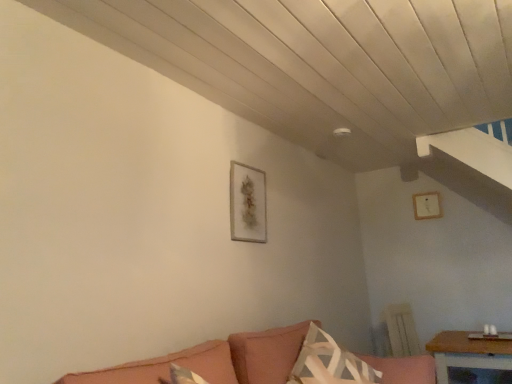
Question: Is white textured pillow at lower center located within velvet pink couch at lower center?

Choices:
 (A) yes
 (B) no

Answer: (A)

Question: Can you confirm if velvet pink couch at lower center is bigger than white textured pillow at lower center?

Choices:
 (A) no
 (B) yes

Answer: (B)

Question: Is velvet pink couch at lower center turned away from white textured pillow at lower center?

Choices:
 (A) no
 (B) yes

Answer: (B)

Question: Would you say velvet pink couch at lower center is outside white textured pillow at lower center?

Choices:
 (A) yes
 (B) no

Answer: (A)

Question: Is the depth of velvet pink couch at lower center greater than that of white textured pillow at lower center?

Choices:
 (A) no
 (B) yes

Answer: (A)

Question: Is point (230, 177) positioned closer to the camera than point (421, 203)?

Choices:
 (A) closer
 (B) farther

Answer: (A)

Question: From their relative heights in the image, would you say matte gold picture frame at center, the second picture frame when ordered from right to left, is taller or shorter than wooden picture frame at upper right, acting as the second picture frame starting from the left?

Choices:
 (A) short
 (B) tall

Answer: (B)

Question: Is matte gold picture frame at center, the second picture frame when ordered from right to left, wider or thinner than wooden picture frame at upper right, which is the second picture frame from front to back?

Choices:
 (A) thin
 (B) wide

Answer: (B)

Question: Considering the positions of matte gold picture frame at center, which ranks as the 2th picture frame in back-to-front order, and wooden picture frame at upper right, which is the second picture frame from front to back, in the image, is matte gold picture frame at center, which ranks as the 2th picture frame in back-to-front order, bigger or smaller than wooden picture frame at upper right, which is the second picture frame from front to back,?

Choices:
 (A) big
 (B) small

Answer: (A)

Question: Considering the positions of point (443, 360) and point (346, 360), is point (443, 360) closer or farther from the camera than point (346, 360)?

Choices:
 (A) closer
 (B) farther

Answer: (B)

Question: In terms of width, does wooden table at lower right look wider or thinner when compared to white textured pillow at lower center?

Choices:
 (A) wide
 (B) thin

Answer: (A)

Question: From the image's perspective, relative to white textured pillow at lower center, is wooden table at lower right above or below?

Choices:
 (A) below
 (B) above

Answer: (A)

Question: Is wooden table at lower right to the left or to the right of white textured pillow at lower center in the image?

Choices:
 (A) left
 (B) right

Answer: (B)

Question: From a real-world perspective, relative to white textured pillow at lower center, is velvet pink couch at lower center vertically above or below?

Choices:
 (A) above
 (B) below

Answer: (B)

Question: Is velvet pink couch at lower center wider or thinner than white textured pillow at lower center?

Choices:
 (A) thin
 (B) wide

Answer: (B)